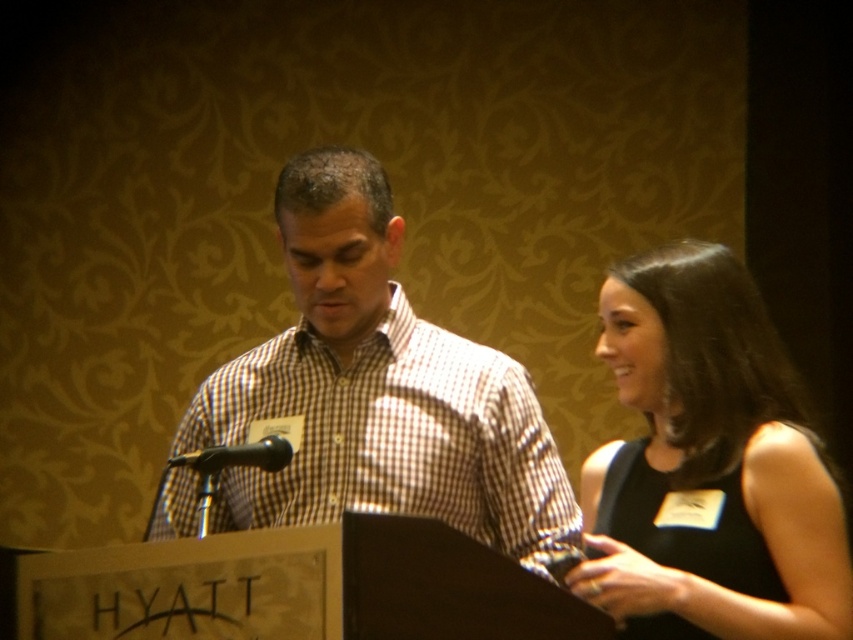
You are organizing a photo shoot and need to position a spotlight exactly at the location of the white checkered shirt at center. According to the coordinates provided, what are the exact coordinates where you should place the spotlight?

The white checkered shirt at center is located at point (378, 392), so you should place the spotlight at those coordinates to ensure it illuminates the white checkered shirt at center properly.

Where is the white checkered shirt at center located in the image?

The white checkered shirt at center is located at point (378, 392).